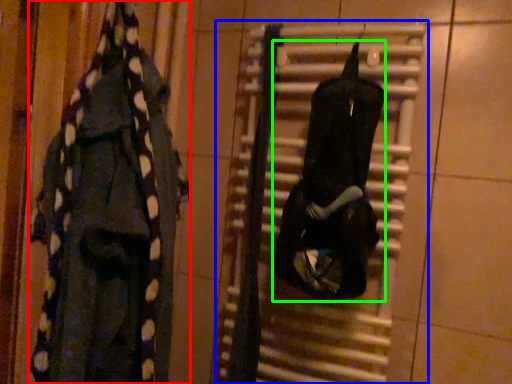
Question: Which object is the closest to the clothing (highlighted by a red box)? Choose among these: radiator (highlighted by a blue box) or clothing (highlighted by a green box).

Choices:
 (A) radiator
 (B) clothing

Answer: (A)